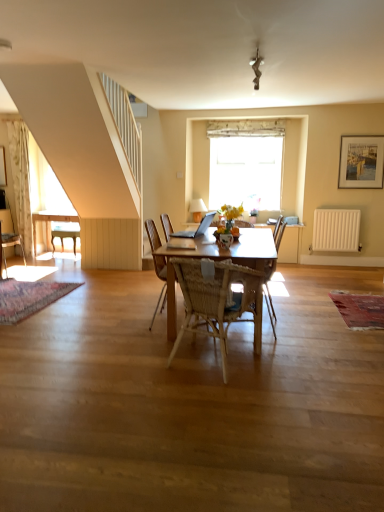
Question: Is translucent glass vase at center taller than woven wood chair at center, the third chair positioned from the back?

Choices:
 (A) no
 (B) yes

Answer: (A)

Question: Considering the relative sizes of translucent glass vase at center and woven wood chair at center, the third chair positioned from the back, in the image provided, is translucent glass vase at center smaller than woven wood chair at center, the third chair positioned from the back,?

Choices:
 (A) no
 (B) yes

Answer: (B)

Question: Does translucent glass vase at center appear on the right side of woven wood chair at center, the first chair from the right?

Choices:
 (A) yes
 (B) no

Answer: (A)

Question: Is translucent glass vase at center positioned beyond the bounds of woven wood chair at center, the first chair from the right?

Choices:
 (A) no
 (B) yes

Answer: (B)

Question: From the image's perspective, is translucent glass vase at center below woven wood chair at center, which ranks as the first chair in front-to-back order?

Choices:
 (A) yes
 (B) no

Answer: (B)

Question: From a real-world perspective, is translucent glass vase at center below woven wood chair at center, the third chair positioned from the back?

Choices:
 (A) yes
 (B) no

Answer: (B)

Question: Can woven wood armchair at center be found inside white matte radiator at right?

Choices:
 (A) no
 (B) yes

Answer: (A)

Question: Is white matte radiator at right closer to camera compared to woven wood armchair at center?

Choices:
 (A) yes
 (B) no

Answer: (B)

Question: Considering the relative positions of white matte radiator at right and woven wood armchair at center in the image provided, is white matte radiator at right to the right of woven wood armchair at center from the viewer's perspective?

Choices:
 (A) no
 (B) yes

Answer: (B)

Question: Does white matte radiator at right have a greater width compared to woven wood armchair at center?

Choices:
 (A) yes
 (B) no

Answer: (B)

Question: Are white matte radiator at right and woven wood armchair at center located far from each other?

Choices:
 (A) yes
 (B) no

Answer: (B)

Question: Can we say white matte radiator at right lies outside woven wood armchair at center?

Choices:
 (A) yes
 (B) no

Answer: (A)

Question: Is woven wood chair at center, which ranks as the first chair in front-to-back order, surrounding wooden framed painting at upper right?

Choices:
 (A) no
 (B) yes

Answer: (A)